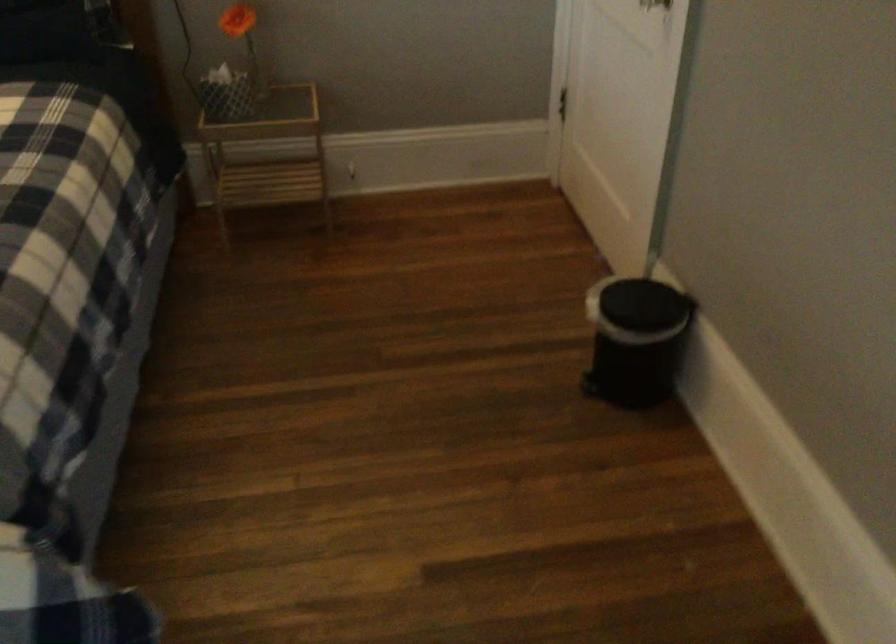
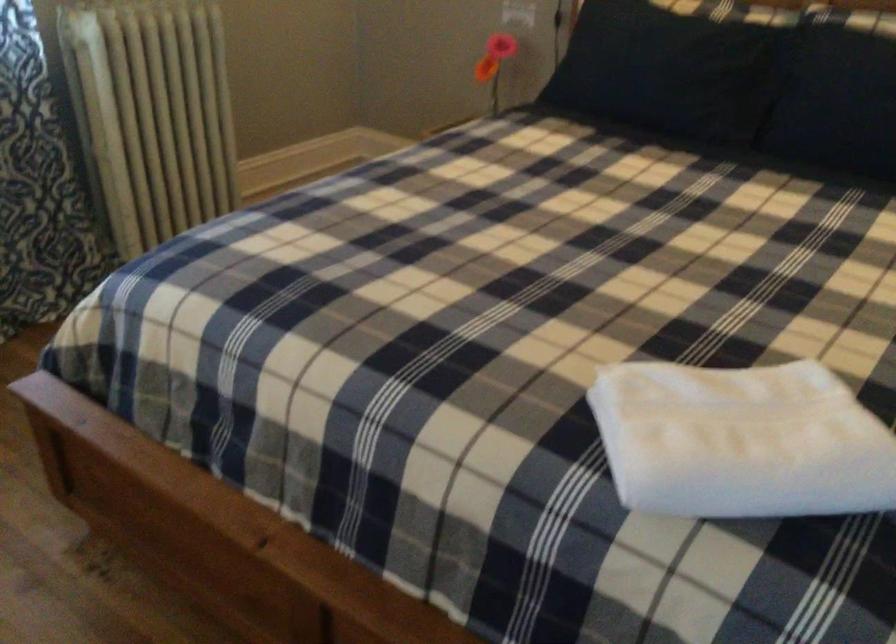
Question: The images are taken continuously from a first-person perspective. In which direction is your viewpoint rotating?

Choices:
 (A) Left
 (B) Right
 (C) Up
 (D) Down

Answer: (A)